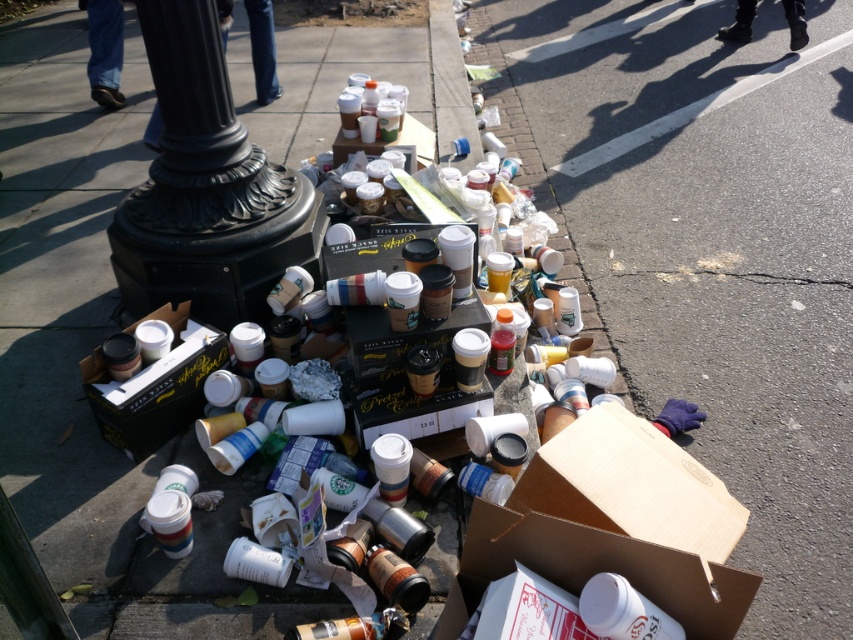
Between cardboard box at lower right and matte cardboard box at center, which one has less height?

Standing shorter between the two is matte cardboard box at center.

Which is more to the right, cardboard box at lower right or matte cardboard box at center?

cardboard box at lower right

Which is behind, point (807, 472) or point (343, 140)?

The point (343, 140) is more distant.

You are a GUI agent. You are given a task and a screenshot of the screen. Output one action in this format:
    pyautogui.click(x=<x>, y=<y>)
    Task: Click on the cardboard box at lower right
    
    Given the screenshot: What is the action you would take?
    pyautogui.click(x=714, y=257)

I want to click on cardboard box at lower right, so click(714, 257).

Who is positioned more to the left, cardboard box at lower right or cardboard box at lower center?

cardboard box at lower center is more to the left.

Is point (511, 113) farther from camera compared to point (508, 572)?

Yes, it is.

The width and height of the screenshot is (853, 640). Find the location of `cardboard box at lower right`. cardboard box at lower right is located at coordinates (714, 257).

Between cardboard box at lower center and matte black box at lower left, which one has less height?

matte black box at lower left

Is cardboard box at lower center shorter than matte black box at lower left?

No.

Find the location of a particular element. Image resolution: width=853 pixels, height=640 pixels. cardboard box at lower center is located at coordinates (612, 525).